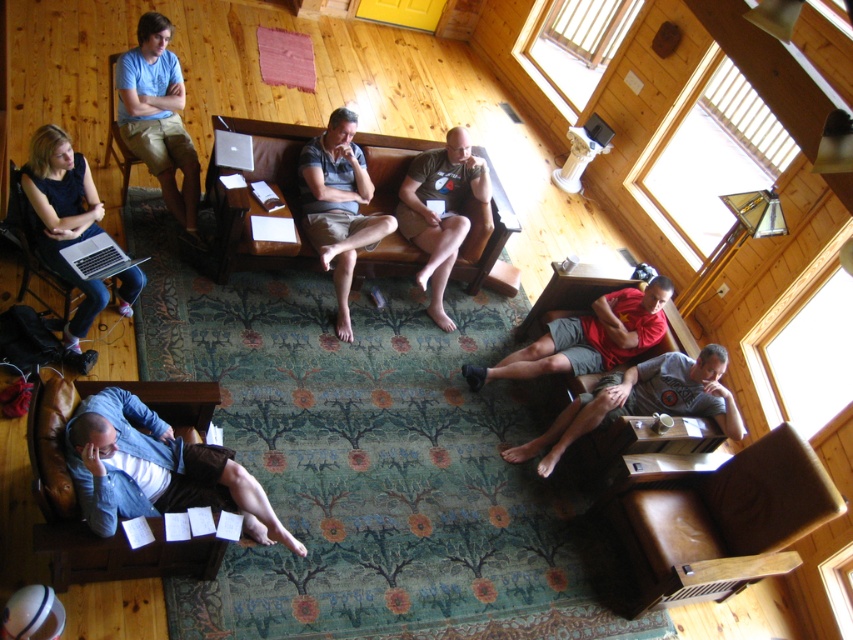
Is brown leather armchair at lower left to the left of matte black laptop at left from the viewer's perspective?

In fact, brown leather armchair at lower left is to the right of matte black laptop at left.

Identify the location of brown leather armchair at lower left. (77, 490).

I want to click on brown leather armchair at lower left, so click(x=77, y=490).

Locate an element on the screen. The image size is (853, 640). brown leather armchair at lower left is located at coordinates (77, 490).

Who is taller, red cotton t-shirt at lower right or matte blue shirt at upper left?

matte blue shirt at upper left is taller.

Measure the distance between red cotton t-shirt at lower right and camera.

They are 5.35 meters apart.

Is point (492, 369) positioned before point (115, 136)?

No, (492, 369) is behind (115, 136).

I want to click on red cotton t-shirt at lower right, so click(x=589, y=337).

Which is more to the right, matte khaki shorts at center or red cotton t-shirt at lower right?

Positioned to the right is red cotton t-shirt at lower right.

Which is in front, point (341, 308) or point (602, 316)?

Point (341, 308) is more forward.

The image size is (853, 640). Identify the location of matte khaki shorts at center. (338, 205).

In order to click on matte khaki shorts at center in this screenshot , I will do `click(338, 205)`.